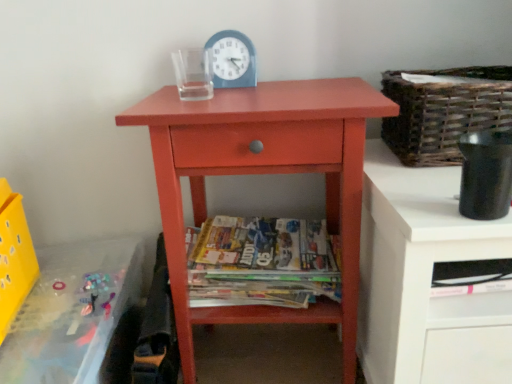
The height and width of the screenshot is (384, 512). Identify the location of free spot above matte wood nightstand at center (from a real-world perspective). (265, 96).